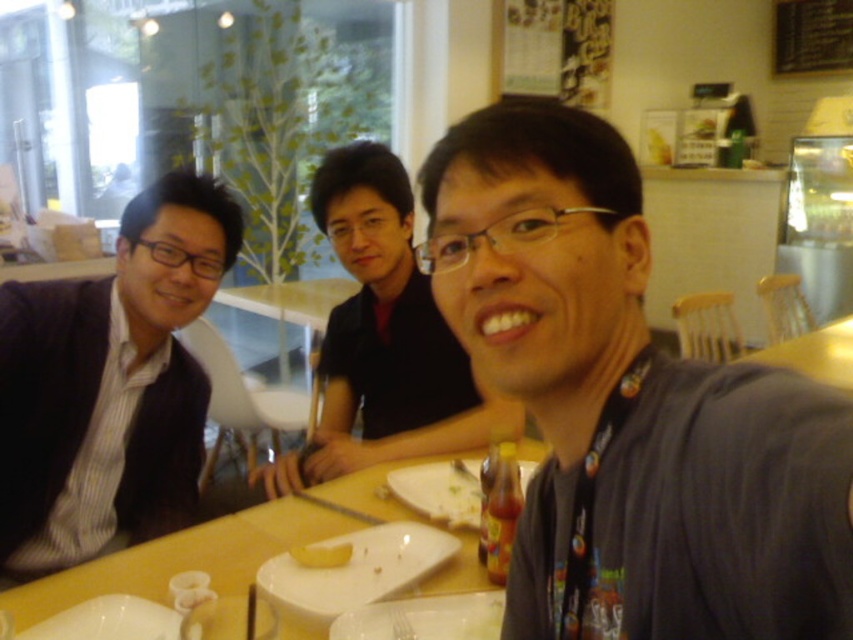
Question: Does matte black shirt at center have a lesser width compared to yellow matte bread at center?

Choices:
 (A) yes
 (B) no

Answer: (B)

Question: Which object is farther from the camera taking this photo?

Choices:
 (A) gray fabric shirt at center
 (B) matte black suit at left
 (C) matte black shirt at center
 (D) wooden table at center

Answer: (C)

Question: Which object appears closest to the camera in this image?

Choices:
 (A) gray fabric shirt at center
 (B) wooden table at center
 (C) matte black shirt at center
 (D) matte black suit at left

Answer: (A)

Question: Is matte black suit at left above matte black shirt at center?

Choices:
 (A) yes
 (B) no

Answer: (B)

Question: Which object appears closest to the camera in this image?

Choices:
 (A) yellow matte bread at center
 (B) wooden table at center

Answer: (B)

Question: Is matte black suit at left thinner than yellow matte bread at center?

Choices:
 (A) no
 (B) yes

Answer: (A)